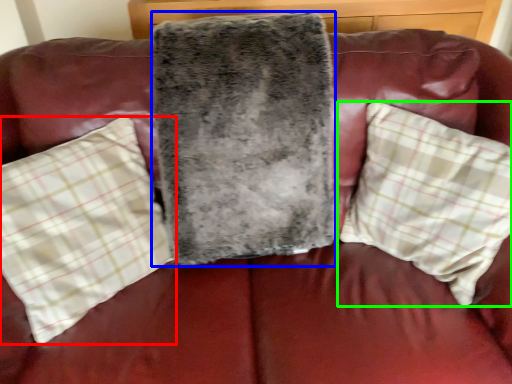
Question: Estimate the real-world distances between objects in this image. Which object is farther from pillow (highlighted by a red box), blanket (highlighted by a blue box) or pillow (highlighted by a green box)?

Choices:
 (A) blanket
 (B) pillow

Answer: (B)